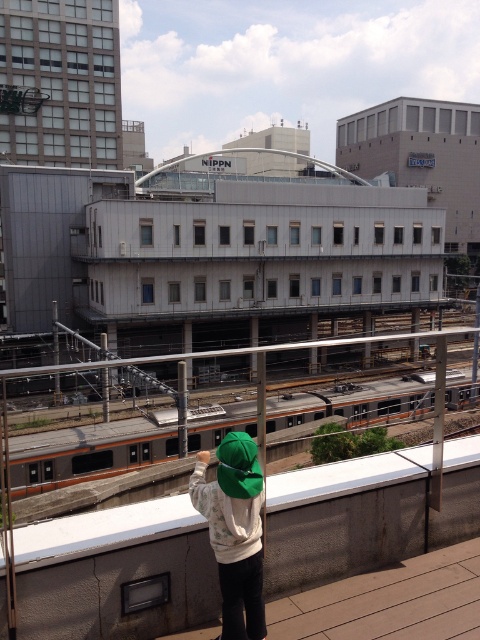
You are a delivery drone operator. Your drone needs to fly from the orange metallic train at center to the green fabric cap at center. Given that the drone can only travel 20 meters, will it be able to complete the journey?

The orange metallic train at center is 31.00 meters from the green fabric cap at center. Since the drone can only travel 20 meters, it will not be able to complete the journey between the orange metallic train at center and the green fabric cap at center.

You are a photographer trying to capture a photo of the orange metallic train at center and the green fabric cap at center in the same frame. Based on their sizes in the image, which object would appear larger in your photo?

The orange metallic train at center appears much larger than the green fabric cap at center in the image, so it would be the larger object in the photo.